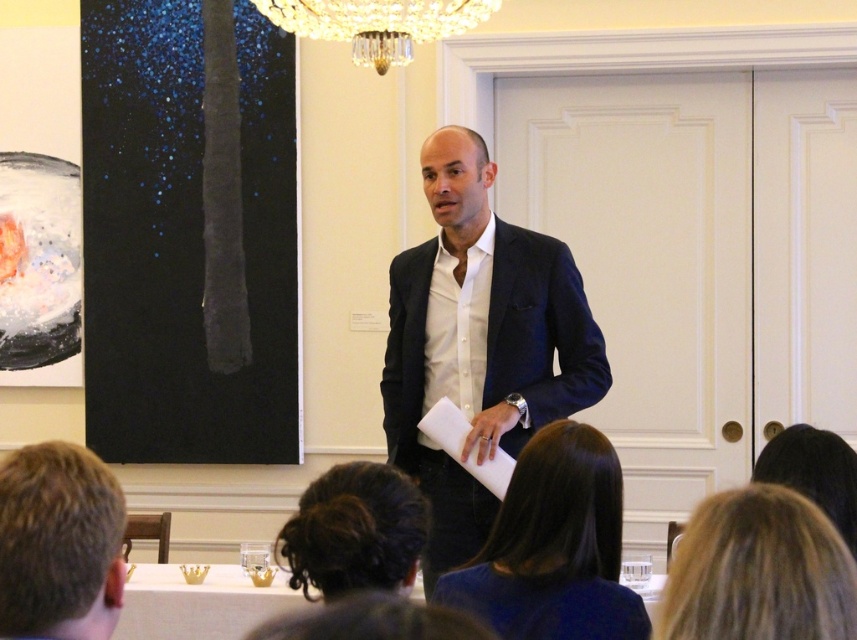
Is dark curly hair at lower center wider than dark brown hair at lower center?

Correct, the width of dark curly hair at lower center exceeds that of dark brown hair at lower center.

Is point (357, 493) less distant than point (373, 636)?

No, (357, 493) is behind (373, 636).

Image resolution: width=857 pixels, height=640 pixels. Identify the location of dark curly hair at lower center. (355, 531).

Looking at this image, is blonde hair at lower right positioned in front of blonde hair at lower left?

Yes, it is in front of blonde hair at lower left.

Does blonde hair at lower right have a lesser width compared to blonde hair at lower left?

In fact, blonde hair at lower right might be wider than blonde hair at lower left.

The width and height of the screenshot is (857, 640). I want to click on blonde hair at lower right, so click(x=758, y=572).

This screenshot has width=857, height=640. What are the coordinates of `blonde hair at lower right` in the screenshot? It's located at (758, 572).

Consider the image. Which of these two, blonde hair at lower right or dark brown hair at lower center, stands taller?

With more height is blonde hair at lower right.

Is the position of blonde hair at lower right less distant than that of dark brown hair at lower center?

No, blonde hair at lower right is further to the viewer.

Find the location of a particular element. blonde hair at lower right is located at coordinates coord(758,572).